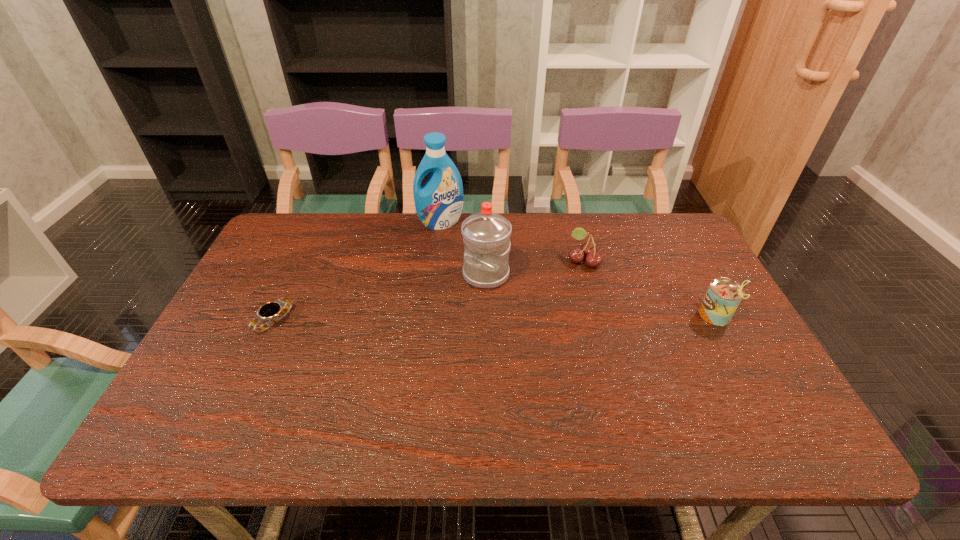
Locate an element on the screen. This screenshot has width=960, height=540. free space between the tallest object and the cherry is located at coordinates (512, 241).

The width and height of the screenshot is (960, 540). Identify the location of unoccupied area between the farthest object and the watch. (357, 272).

Identify the location of object that stands as the closest to the detergent. This screenshot has width=960, height=540. (486, 234).

This screenshot has height=540, width=960. I want to click on the third closest object to the can, so click(439, 202).

The image size is (960, 540). What are the coordinates of `vacant position in the image that satisfies the following two spatial constraints: 1. on the back side of the fourth shortest object; 2. on the left side of the cherry` in the screenshot? It's located at (486, 260).

Where is `free location that satisfies the following two spatial constraints: 1. on the back side of the watch; 2. on the left side of the third object from left to right`? Image resolution: width=960 pixels, height=540 pixels. free location that satisfies the following two spatial constraints: 1. on the back side of the watch; 2. on the left side of the third object from left to right is located at coordinates (296, 274).

Where is `vacant area in the image that satisfies the following two spatial constraints: 1. on the front side of the second object from left to right; 2. on the right side of the rightmost object`? vacant area in the image that satisfies the following two spatial constraints: 1. on the front side of the second object from left to right; 2. on the right side of the rightmost object is located at coordinates (430, 316).

What are the coordinates of `vacant area in the image that satisfies the following two spatial constraints: 1. on the front side of the farthest object; 2. on the left side of the can` in the screenshot? It's located at (430, 316).